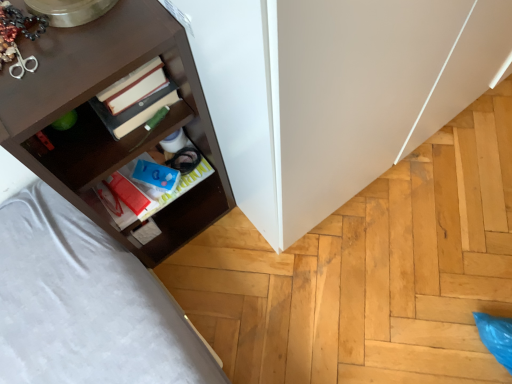
Image resolution: width=512 pixels, height=384 pixels. I want to click on vacant area on top of dark brown wood shelf at left (from a real-world perspective), so click(x=60, y=34).